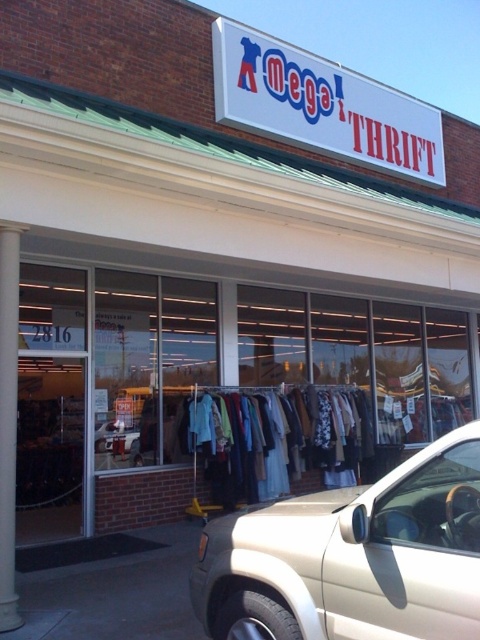
You are a delivery driver who needs to park your truck, which is 2.5 meters wide, between the gold metallic suv at center and the white smooth column at left. Is there enough space for your truck to fit between them?

The gold metallic suv at center is 2.74 meters from the white smooth column at left, so yes, the truck can fit between them since the distance is greater than the truck width.